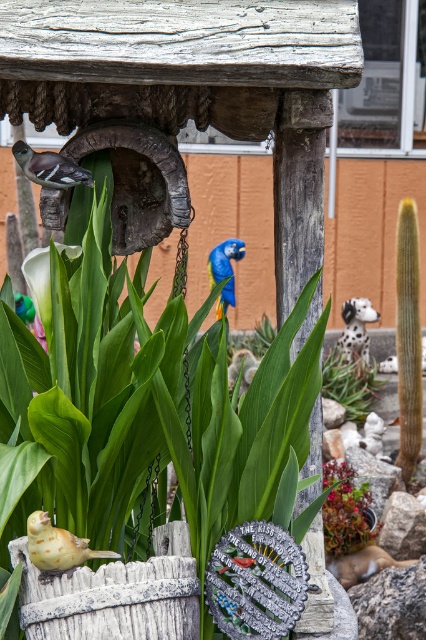
Question: Which object appears farthest from the camera in this image?

Choices:
 (A) blue glossy parrot at center
 (B) matte green succulent at center

Answer: (A)

Question: Which of the following is the farthest from the observer?

Choices:
 (A) (331, 481)
 (B) (373, 390)

Answer: (B)

Question: Which point appears farthest from the camera in this image?

Choices:
 (A) (348, 417)
 (B) (224, 259)
 (C) (45, 320)

Answer: (B)

Question: Can you confirm if matte yellow bird at lower left is thinner than blue glossy parrot at center?

Choices:
 (A) yes
 (B) no

Answer: (A)

Question: Can you confirm if matte green succulent at center is thinner than white matte calla lily at center?

Choices:
 (A) yes
 (B) no

Answer: (A)

Question: Is matte green succulent at center closer to camera compared to matte yellow bird at lower left?

Choices:
 (A) no
 (B) yes

Answer: (A)